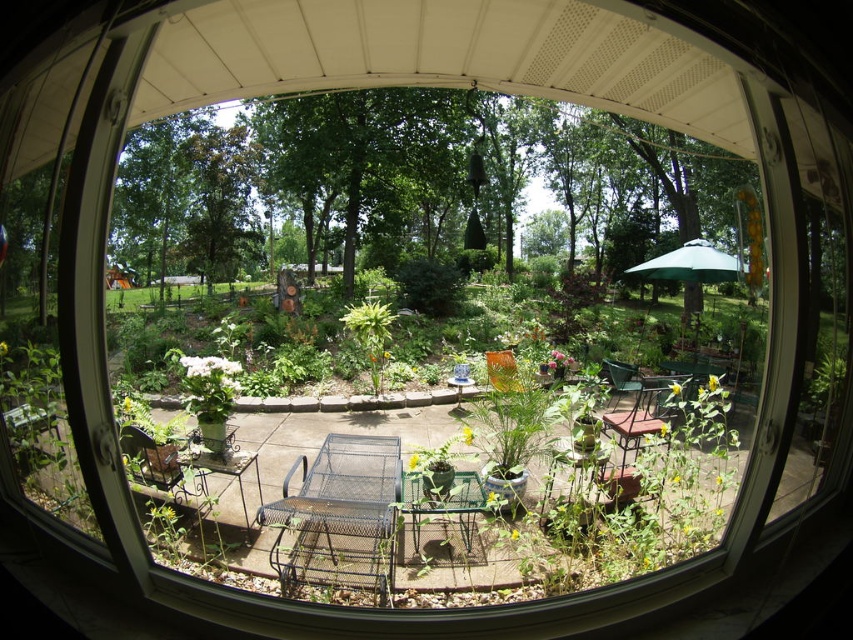
Is metal mesh chair at center positioned behind metallic brown chair at lower left?

No, metal mesh chair at center is in front of metallic brown chair at lower left.

Does metal mesh chair at center have a greater width compared to metallic brown chair at lower left?

Correct, the width of metal mesh chair at center exceeds that of metallic brown chair at lower left.

Who is more forward, [399,465] or [151,477]?

Point [151,477]

At what (x,y) coordinates should I click in order to perform the action: click on metal mesh chair at center. Please return your answer as a coordinate pair (x, y). Image resolution: width=853 pixels, height=640 pixels. Looking at the image, I should click on (343, 492).

Looking at this image, can you confirm if brown metal chair at center is shorter than green metal chair at center?

Correct, brown metal chair at center is not as tall as green metal chair at center.

Who is more forward, [608,422] or [635,380]?

Positioned in front is point [608,422].

Who is more forward, (666, 397) or (616, 397)?

Point (666, 397) is more forward.

Locate an element on the screen. brown metal chair at center is located at coordinates (640, 416).

Is point (465, 484) positioned behind point (631, 384)?

No, (465, 484) is closer to viewer.

Image resolution: width=853 pixels, height=640 pixels. What do you see at coordinates (444, 504) in the screenshot?
I see `green wire chair at center` at bounding box center [444, 504].

You are a GUI agent. You are given a task and a screenshot of the screen. Output one action in this format:
    pyautogui.click(x=<x>, y=<y>)
    Task: Click on the green wire chair at center
    
    Given the screenshot: What is the action you would take?
    pyautogui.click(x=444, y=504)